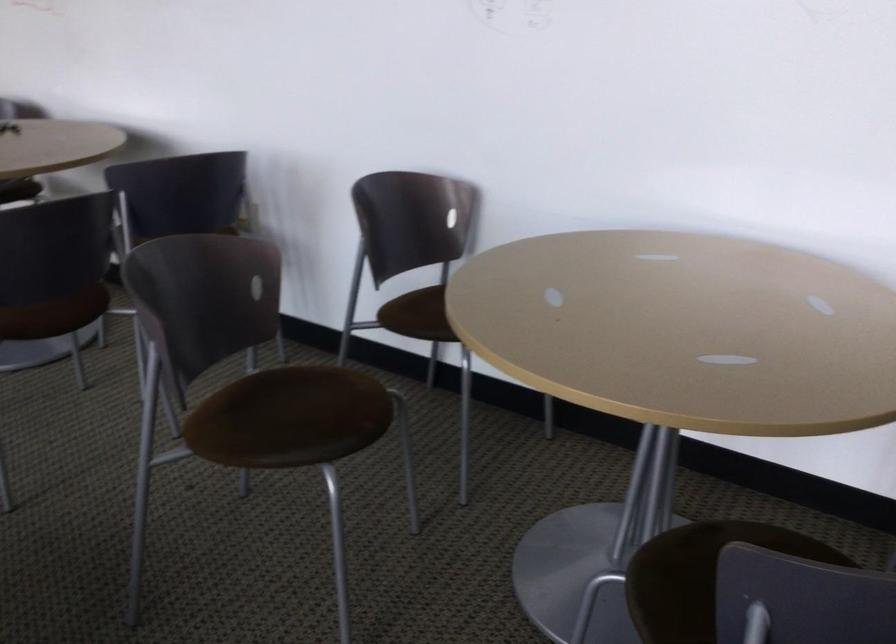
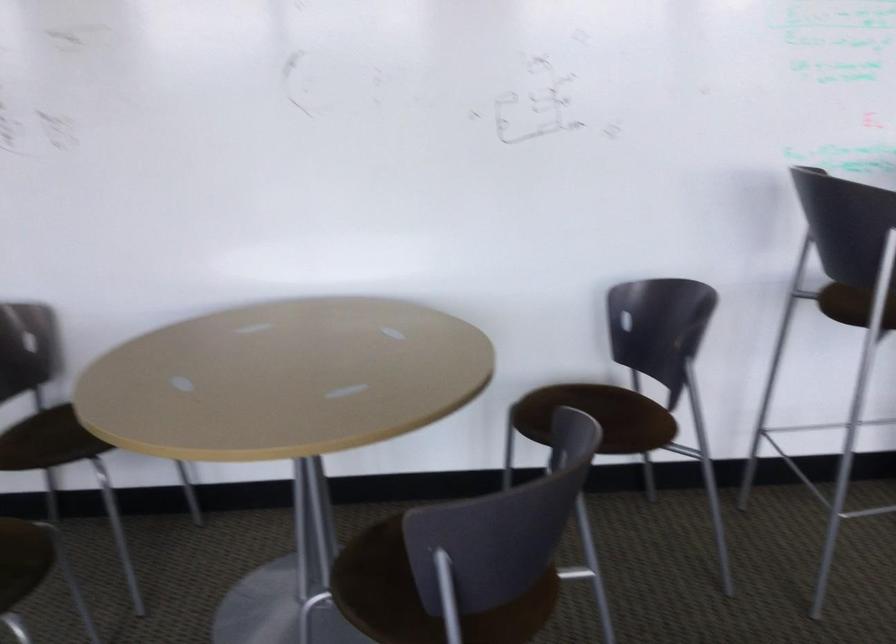
The point at (366, 430) is marked in the first image. Where is the corresponding point in the second image?

(22, 560)